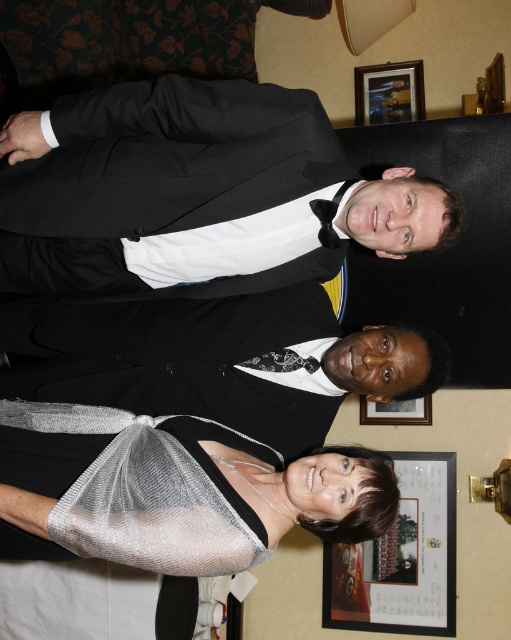
Question: Which of the following is the closest to the observer?

Choices:
 (A) shiny silver dress at center
 (B) wooden picture frame at lower right

Answer: (A)

Question: Is framed paper at lower right thinner than black satin tie at center?

Choices:
 (A) yes
 (B) no

Answer: (B)

Question: Is shiny silver dress at center to the left of wooden picture frame at upper center from the viewer's perspective?

Choices:
 (A) yes
 (B) no

Answer: (A)

Question: From the image, what is the correct spatial relationship of wooden picture frame at upper center in relation to black satin tie at center?

Choices:
 (A) left
 (B) right

Answer: (B)

Question: Based on their relative distances, which object is farther from the wooden picture frame at upper center?

Choices:
 (A) shiny silver dress at center
 (B) black satin tie at center
 (C) silver mesh shawl at lower center
 (D) wooden picture frame at lower right

Answer: (C)

Question: Estimate the real-world distances between objects in this image. Which object is farther from the shiny silver dress at center?

Choices:
 (A) wooden picture frame at lower right
 (B) silver mesh shawl at lower center
 (C) black satin tuxedo at upper center

Answer: (A)